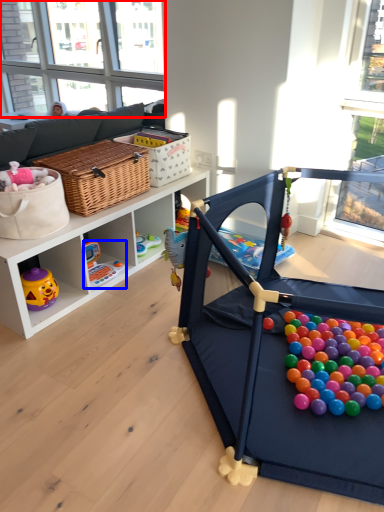
Question: Among these objects, which one is nearest to the camera, window screen (highlighted by a red box) or toy (highlighted by a blue box)?

Choices:
 (A) window screen
 (B) toy

Answer: (B)